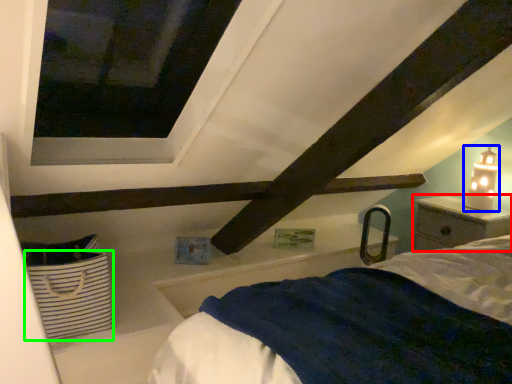
Question: Which object is the closest to the nightstand (highlighted by a red box)? Choose among these: table lamp (highlighted by a blue box) or basket (highlighted by a green box).

Choices:
 (A) table lamp
 (B) basket

Answer: (A)